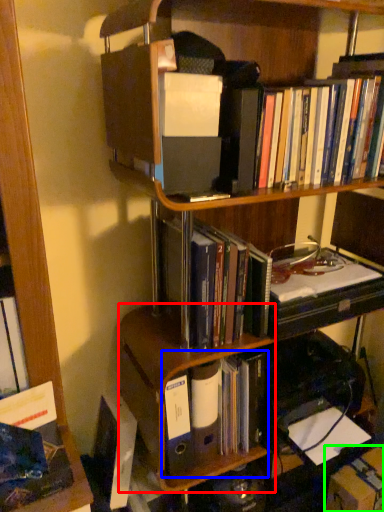
Question: Which is nearer to the shelf (highlighted by a red box)? book (highlighted by a blue box) or cardboard box (highlighted by a green box).

Choices:
 (A) book
 (B) cardboard box

Answer: (A)